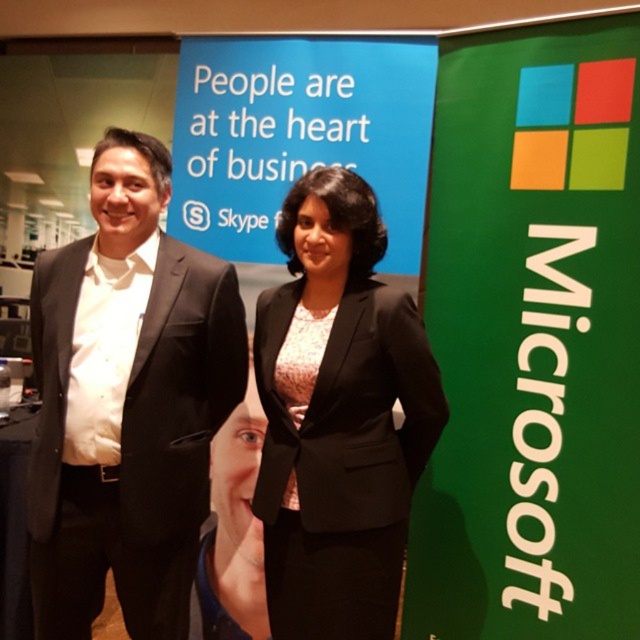
Between black fabric suit at center and pink textured dress at center, which one is positioned lower?

black fabric suit at center is lower down.

How far apart are black fabric suit at center and pink textured dress at center?

4.79 inches

This screenshot has width=640, height=640. I want to click on black fabric suit at center, so click(x=339, y=417).

Does black glossy suit at center have a lesser width compared to smooth skin face at center?

No.

Is point (230, 280) positioned in front of point (257, 582)?

Yes, point (230, 280) is in front of point (257, 582).

What are the coordinates of `black glossy suit at center` in the screenshot? It's located at (125, 403).

In order to click on black glossy suit at center in this screenshot , I will do `click(125, 403)`.

Does black matte suit at left have a lesser width compared to pink textured dress at center?

Incorrect, black matte suit at left's width is not less than pink textured dress at center's.

Is black matte suit at left closer to camera compared to pink textured dress at center?

Yes, black matte suit at left is in front of pink textured dress at center.

Image resolution: width=640 pixels, height=640 pixels. Find the location of `black matte suit at left`. black matte suit at left is located at coordinates (131, 444).